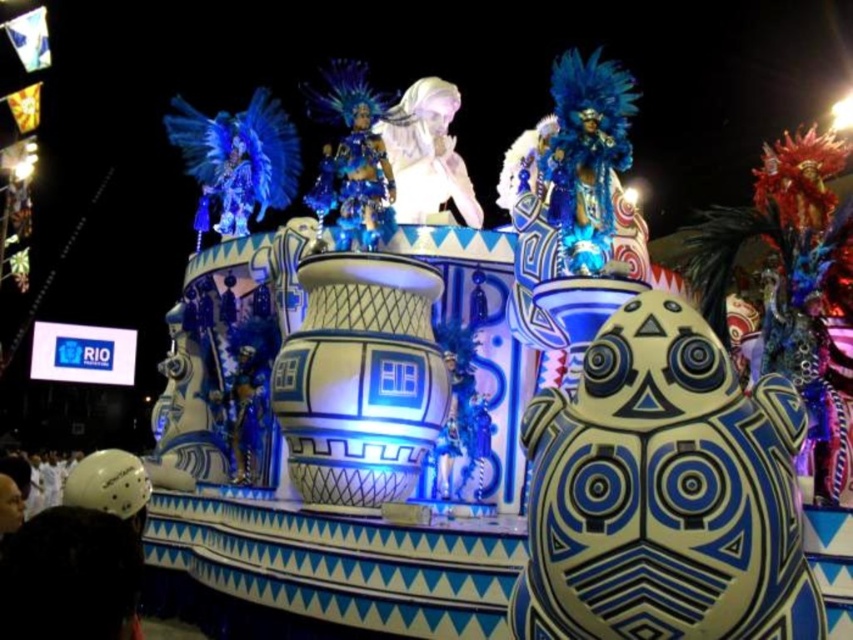
Question: Does white glossy mask at center appear on the left side of sparkly blue costume at center?

Choices:
 (A) no
 (B) yes

Answer: (A)

Question: Which object appears closest to the camera in this image?

Choices:
 (A) white glossy mask at center
 (B) white matte helmet at lower left
 (C) sparkly blue costume at center

Answer: (B)

Question: Which point is farther to the camera?

Choices:
 (A) sparkly blue costume at center
 (B) white glossy mask at center
 (C) white matte helmet at lower left

Answer: (B)

Question: Can you confirm if sparkly blue costume at center is positioned to the left of white matte helmet at lower left?

Choices:
 (A) no
 (B) yes

Answer: (A)

Question: Is sparkly blue costume at center positioned in front of white matte helmet at lower left?

Choices:
 (A) no
 (B) yes

Answer: (A)

Question: Estimate the real-world distances between objects in this image. Which object is farther from the white glossy mask at center?

Choices:
 (A) sparkly blue costume at center
 (B) white matte helmet at lower left

Answer: (B)